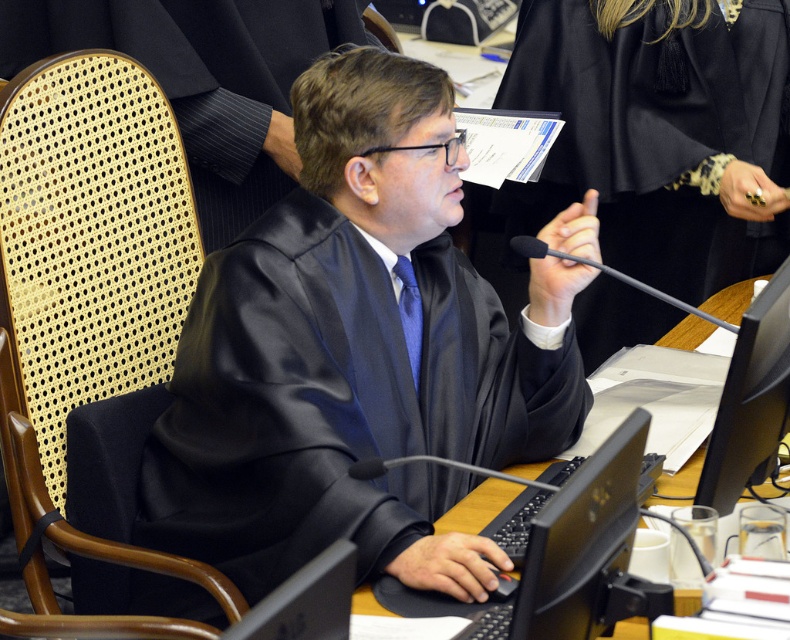
In the scene shown: You are an assistant in the courtroom. You need to determine the relative height of the satin black robe at center and the black glossy monitor at lower right. Which one is taller?

The satin black robe at center is taller than the black glossy monitor at lower right.

You are an interior designer planning to place a new desk between the satin black robe at center and the black glossy monitor at lower right. Based on the current arrangement, which object occupies more horizontal space and should be considered for positioning?

The satin black robe at center might be wider than black glossy monitor at lower right, so it occupies more horizontal space and should be considered for positioning.

In the scene shown: You are an attendee in the courtroom and want to determine the spatial relationship between two points marked in the scene. Which point is closer to you, point (344, 435) or point (222, 216)?

Result: Point (344, 435) is in front of point (222, 216), so it is closer to you.